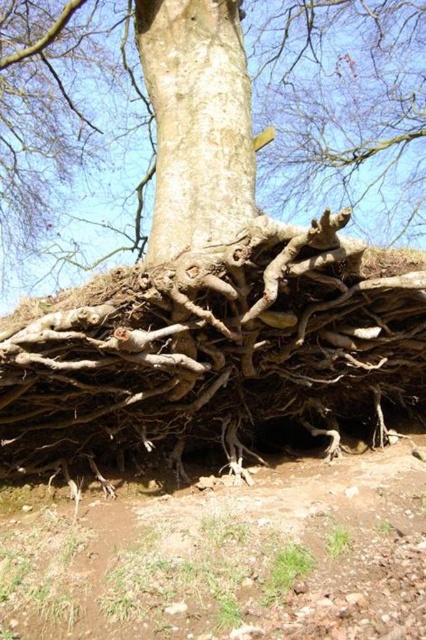
You are a gardener trying to plant a new shrub near the tree. You need to know which area has more space to dig. Based on the image, which has a larger area to work with, the brown soil at lower center or the smooth brown bark at center?

The smooth brown bark at center has a larger area compared to the brown soil at lower center, so you should choose the area around the smooth brown bark at center for planting the shrub.

You are a gardener trying to plant a new shrub between the brown rough roots at center and the brown soil at lower center. Based on their positions, which object should you dig near to ensure the shrub has enough space to grow?

You should dig near the brown soil at lower center because the brown rough roots at center is positioned to the right of it, so the soil area is more suitable for planting where roots are less obstructive.

You are a gardener trying to determine which part of the tree to water first. Based on the image, which object is closer to you between the brown rough roots at center and the smooth brown bark at center?

The brown rough roots at center are closer to you than the smooth brown bark at center, so you should water the brown rough roots at center first.